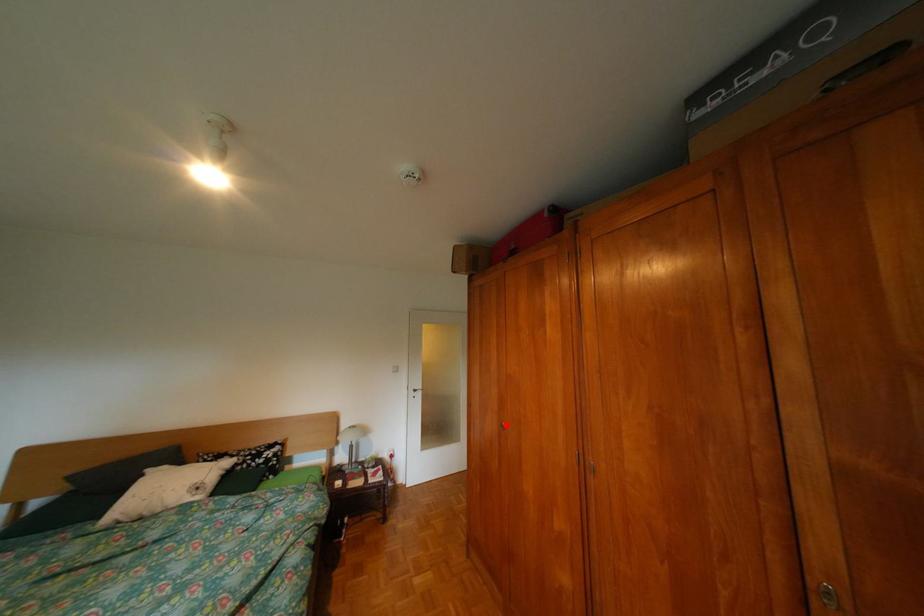
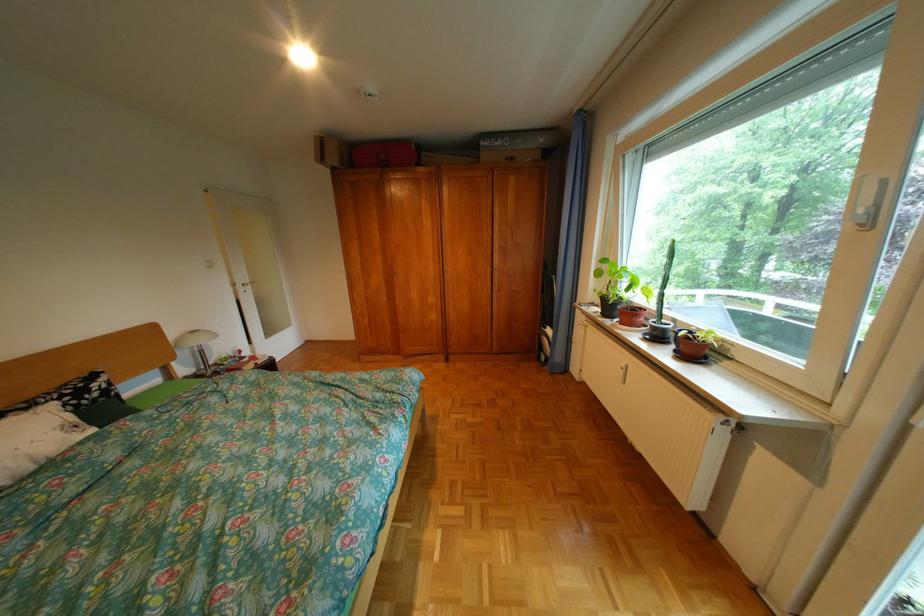
Find the pixel in the second image that matches the highlighted location in the first image.

(392, 280)